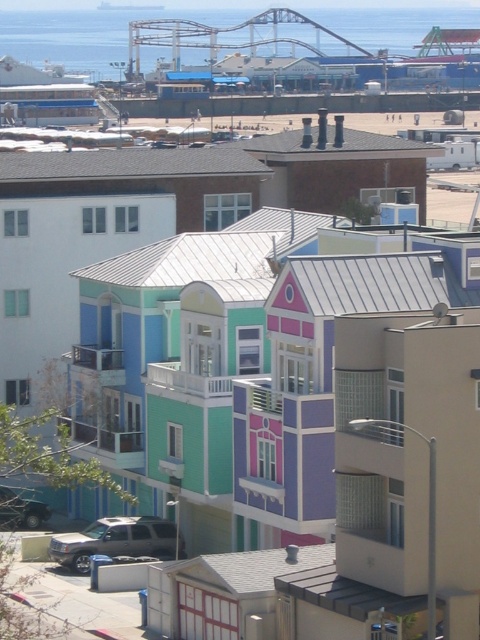
You are standing at the center of the image and want to locate the silver metallic suv at lower left. Which direction should you look to find it?

You should look to the lower left direction to find the silver metallic suv at lower left.

You are standing at the edge of the boardwalk and want to take a photo of the silver metallic suv at lower left and the metallic silver car at lower left. Which one will appear larger in your photo?

The silver metallic suv at lower left will appear larger in the photo because it is closer to the viewer than the metallic silver car at lower left.